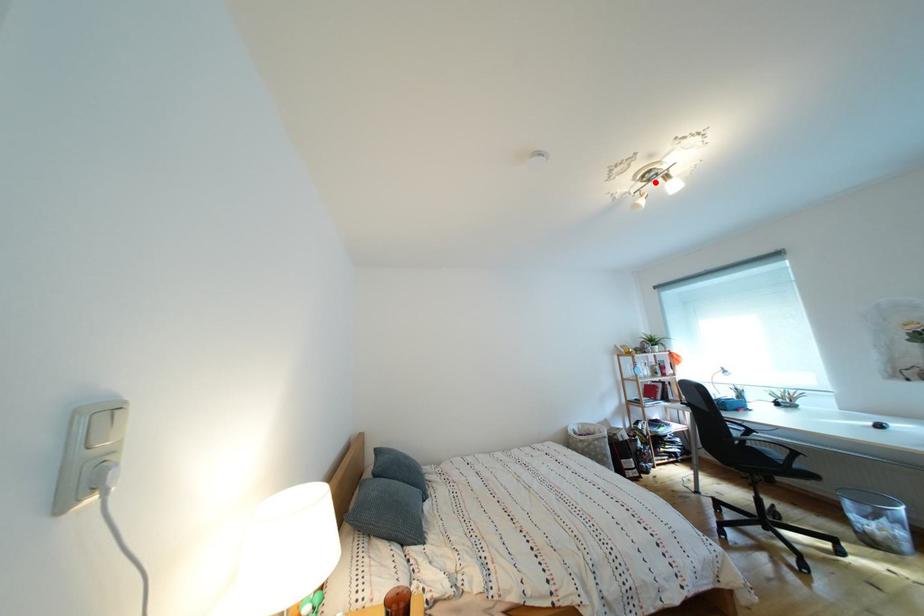
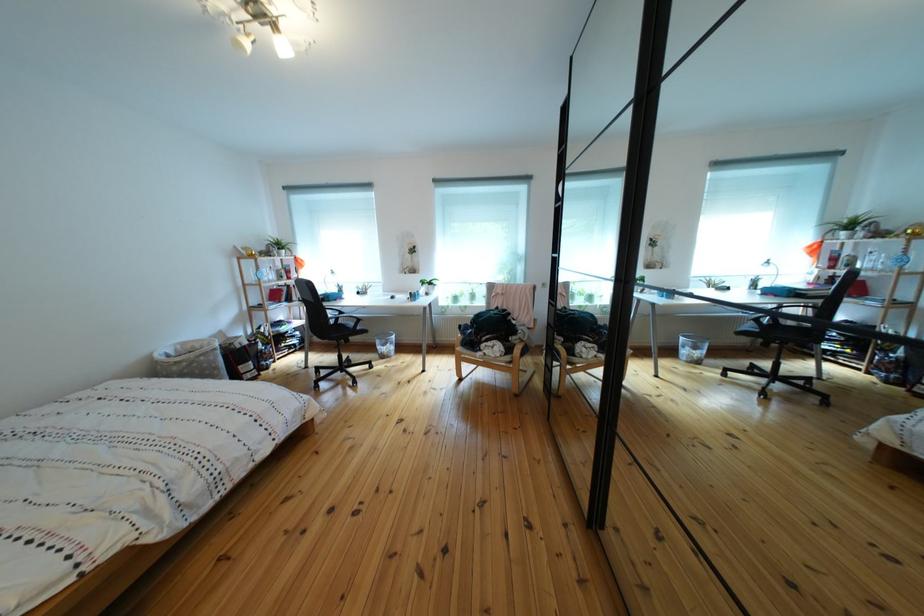
Where in the second image is the point corresponding to the highlighted location from the first image?

(258, 10)